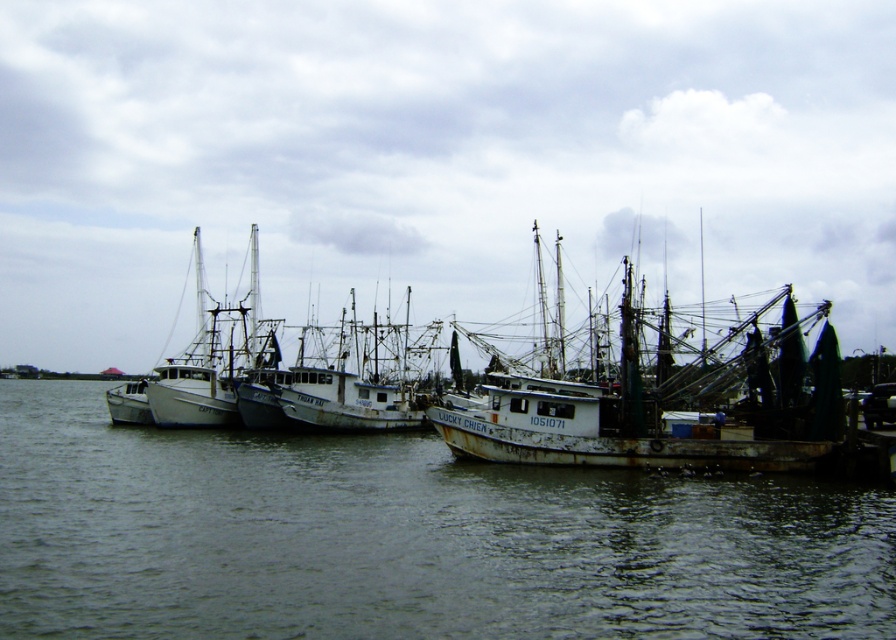
You are standing at the point with coordinates point (274,561) and want to walk towards the point with coordinates point (636,403). Which direction should you face to move directly towards it?

You should face towards the direction of point (636,403), which is behind point (274,561).

You are a photographer planning to capture a wide shot of the harbor scene. You want to ensure that both the gray matte water at lower left and the rusty metal boat at center are clearly visible in your photo. Based on their sizes, which object should you prioritize framing closer to the camera to maintain detail?

The gray matte water at lower left is smaller than the rusty metal boat at center. To maintain detail for both, prioritize framing the gray matte water at lower left closer to the camera since it is smaller and might require more focus to capture clearly.